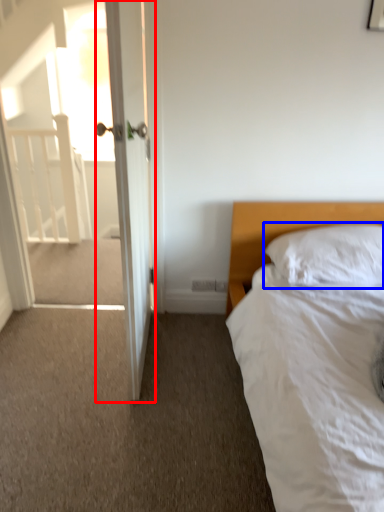
Question: Which object is closer to the camera taking this photo, door (highlighted by a red box) or pillow (highlighted by a blue box)?

Choices:
 (A) door
 (B) pillow

Answer: (A)